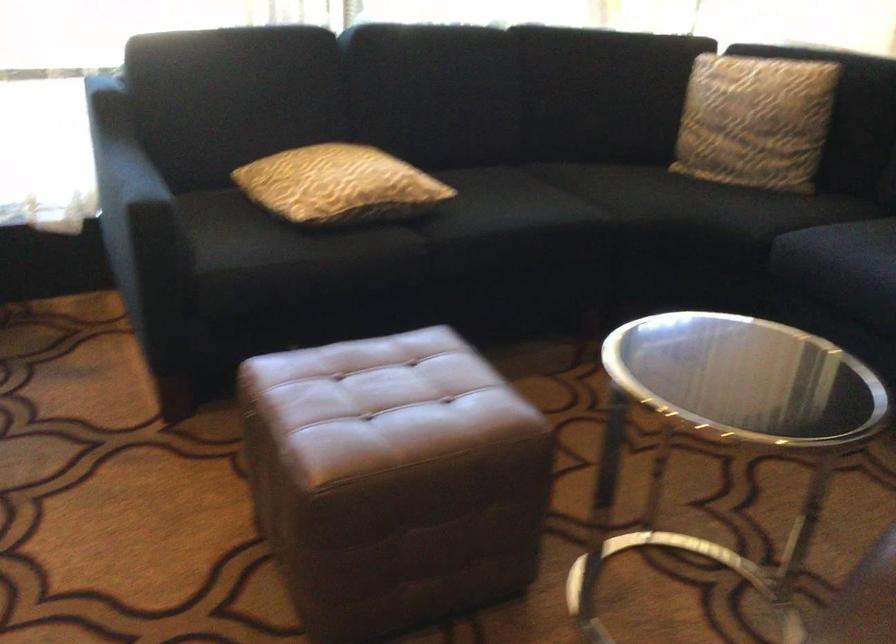
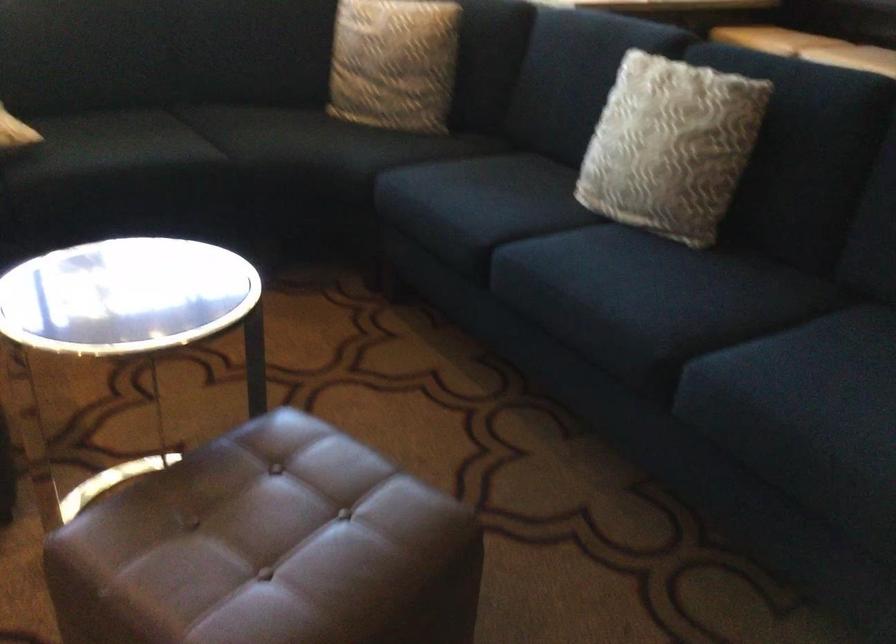
Question: The images are taken continuously from a first-person perspective. In which direction are you moving?

Choices:
 (A) Left
 (B) Right
 (C) Forward
 (D) Backward

Answer: (B)